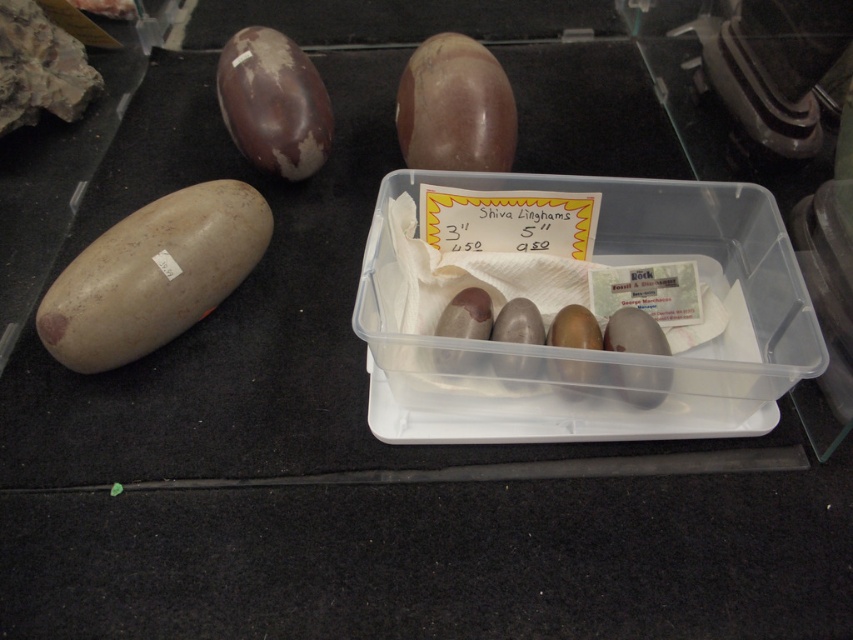
Who is more forward, (x=495, y=67) or (x=306, y=140)?

Point (x=495, y=67)

Is shiny brown stone at upper center to the left of brown matte egg at upper left from the viewer's perspective?

No, shiny brown stone at upper center is not to the left of brown matte egg at upper left.

Which is in front, point (479, 140) or point (293, 51)?

Point (479, 140) is more forward.

Identify the location of shiny brown stone at upper center. (456, 108).

Is matte brown potato at left bigger than shiny brown stone at upper center?

Indeed, matte brown potato at left has a larger size compared to shiny brown stone at upper center.

Is matte brown potato at left wider than shiny brown stone at upper center?

Indeed, matte brown potato at left has a greater width compared to shiny brown stone at upper center.

The image size is (853, 640). I want to click on matte brown potato at left, so click(x=154, y=275).

Which is above, matte brown potato at left or brown matte egg at upper left?

Positioned higher is brown matte egg at upper left.

Does matte brown potato at left have a smaller size compared to brown matte egg at upper left?

No, matte brown potato at left is not smaller than brown matte egg at upper left.

The image size is (853, 640). What are the coordinates of `matte brown potato at left` in the screenshot? It's located at (154, 275).